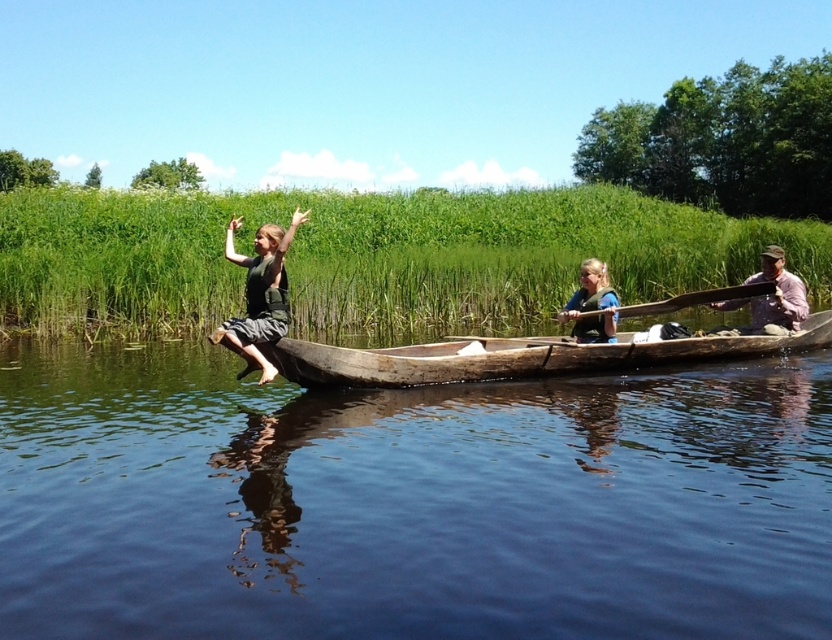
Question: Which point is farther to the camera?

Choices:
 (A) green fabric person at left
 (B) transparent water at boat front
 (C) matte blue life vest at center
 (D) light brown wooden paddle at right

Answer: (D)

Question: Estimate the real-world distances between objects in this image. Which object is closer to the wooden canoe at center?

Choices:
 (A) wooden paddle at center
 (B) transparent water at boat front
 (C) matte blue life vest at center

Answer: (C)

Question: Can you confirm if transparent water at boat front is wider than matte blue life vest at center?

Choices:
 (A) no
 (B) yes

Answer: (B)

Question: Which of the following is the farthest from the observer?

Choices:
 (A) (785, 321)
 (B) (745, 292)
 (C) (93, 516)

Answer: (A)

Question: Can you confirm if matte blue life vest at center is positioned above wooden paddle at center?

Choices:
 (A) no
 (B) yes

Answer: (B)

Question: Is wooden canoe at center positioned in front of matte blue life vest at center?

Choices:
 (A) yes
 (B) no

Answer: (B)